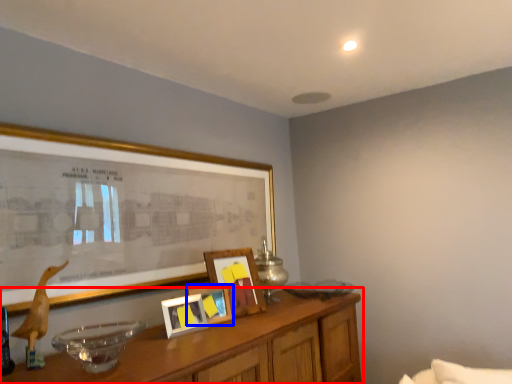
Question: Which object is closer to the camera taking this photo, table (highlighted by a red box) or picture frame (highlighted by a blue box)?

Choices:
 (A) table
 (B) picture frame

Answer: (A)